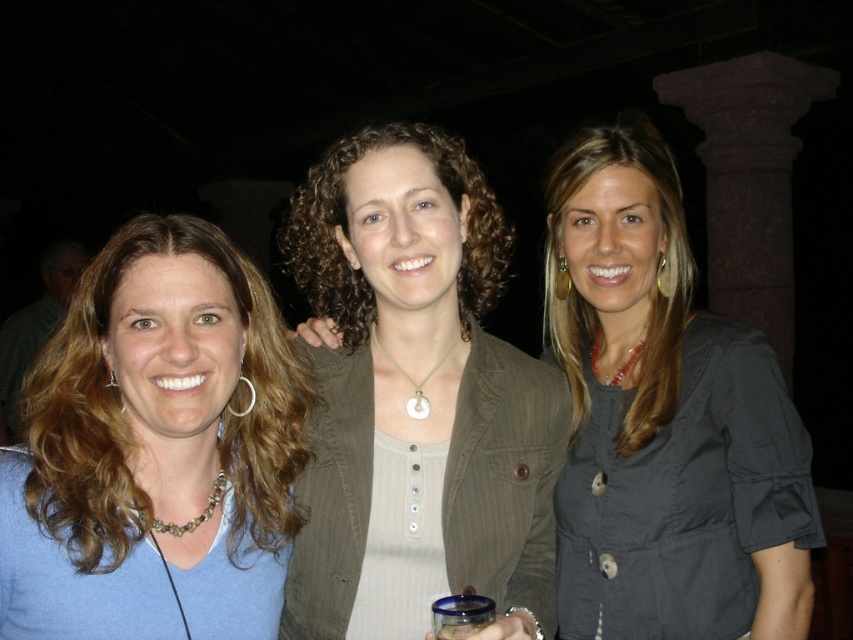
Does point (460, 506) come closer to viewer compared to point (105, 426)?

No, it is behind (105, 426).

Which is in front, point (525, 620) or point (79, 420)?

Point (525, 620) is in front.

The width and height of the screenshot is (853, 640). Find the location of `matte olive green blazer at center`. matte olive green blazer at center is located at coordinates (418, 394).

Is matte black blouse at right to the right of blue fabric shirt at left from the viewer's perspective?

Correct, you'll find matte black blouse at right to the right of blue fabric shirt at left.

Is matte black blouse at right wider than blue fabric shirt at left?

No.

Is point (651, 188) positioned before point (218, 392)?

No, it is not.

In order to click on matte black blouse at right in this screenshot , I will do `click(664, 419)`.

Does point (471, 570) come in front of point (573, 458)?

Yes, it is in front of point (573, 458).

Can you confirm if matte olive green blazer at center is wider than matte black blouse at right?

Indeed, matte olive green blazer at center has a greater width compared to matte black blouse at right.

What are the coordinates of `matte olive green blazer at center` in the screenshot? It's located at (418, 394).

At what (x,y) coordinates should I click in order to perform the action: click on matte olive green blazer at center. Please return your answer as a coordinate pair (x, y). Image resolution: width=853 pixels, height=640 pixels. Looking at the image, I should click on (418, 394).